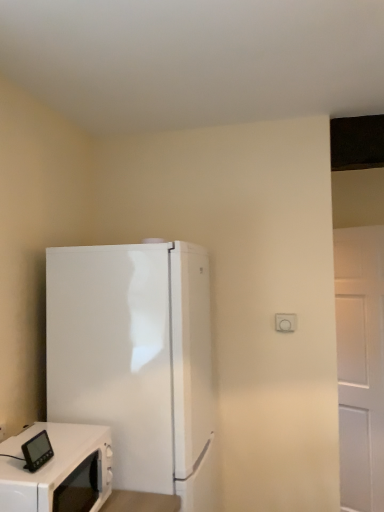
Question: Relative to white glossy refrigerator at left, is white glossy microwave at lower left in front or behind?

Choices:
 (A) behind
 (B) front

Answer: (B)

Question: Looking at their shapes, would you say white glossy microwave at lower left is wider or thinner than white glossy refrigerator at left?

Choices:
 (A) thin
 (B) wide

Answer: (A)

Question: Does point (38, 481) appear closer or farther from the camera than point (119, 332)?

Choices:
 (A) closer
 (B) farther

Answer: (A)

Question: Considering the positions of white glossy refrigerator at left and white glossy microwave at lower left in the image, is white glossy refrigerator at left taller or shorter than white glossy microwave at lower left?

Choices:
 (A) short
 (B) tall

Answer: (B)

Question: Is point (112, 381) closer or farther from the camera than point (49, 487)?

Choices:
 (A) farther
 (B) closer

Answer: (A)

Question: From a real-world perspective, is white glossy refrigerator at left physically located above or below white glossy microwave at lower left?

Choices:
 (A) above
 (B) below

Answer: (A)

Question: Looking at their shapes, would you say white glossy refrigerator at left is wider or thinner than white glossy microwave at lower left?

Choices:
 (A) thin
 (B) wide

Answer: (B)